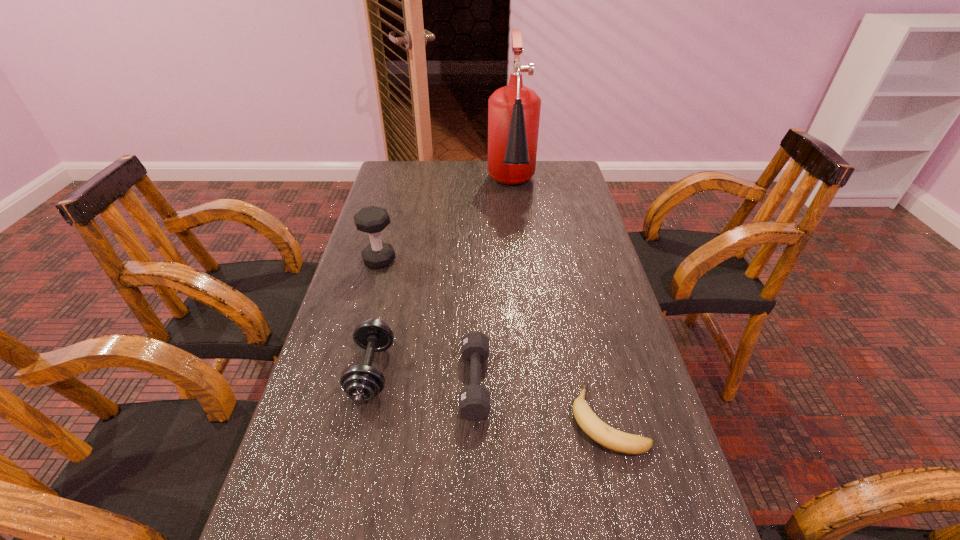
This screenshot has height=540, width=960. What are the coordinates of `the closest dumbbell to the second farthest object` in the screenshot? It's located at (361, 383).

The image size is (960, 540). I want to click on dumbbell that is the second nearest to the tallest dumbbell, so click(474, 400).

The height and width of the screenshot is (540, 960). Find the location of `vacant position in the image that satisfies the following two spatial constraints: 1. with the nozzle aimed from the farthest object; 2. on the left side of the banana`. vacant position in the image that satisfies the following two spatial constraints: 1. with the nozzle aimed from the farthest object; 2. on the left side of the banana is located at coordinates (538, 419).

Locate an element on the screen. The height and width of the screenshot is (540, 960). vacant area in the image that satisfies the following two spatial constraints: 1. on the front side of the third object from left to right; 2. on the right side of the farthest dumbbell is located at coordinates (346, 382).

Identify the location of free region that satisfies the following two spatial constraints: 1. with the nozzle aimed from the tallest object; 2. on the right side of the banana. (538, 419).